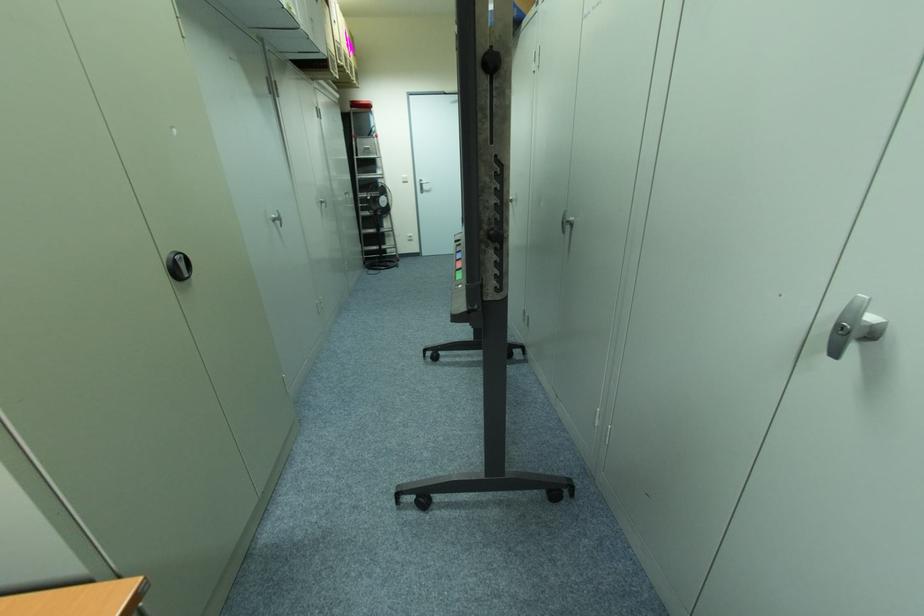
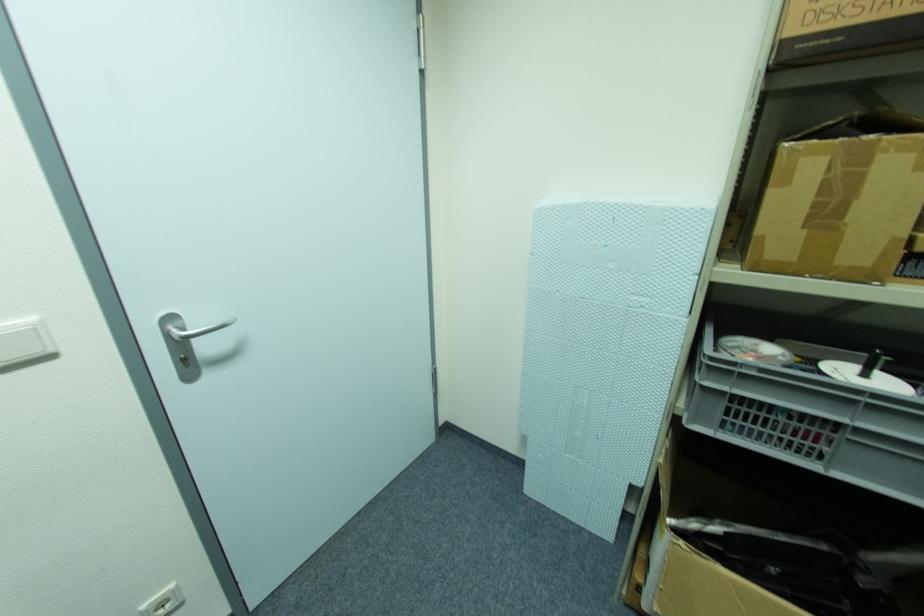
Find the pixel in the second image that matches point 407,177 in the first image.

(34, 331)